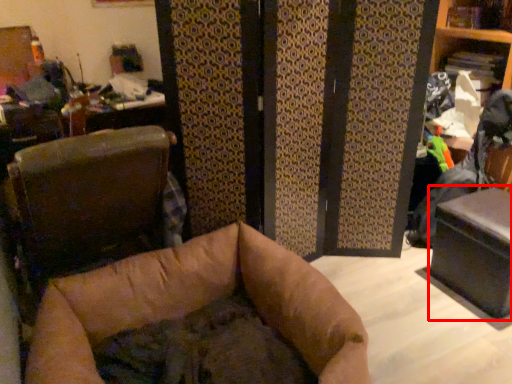
Question: From the image's perspective, what is the correct spatial relationship of table (annotated by the red box) in relation to furniture?

Choices:
 (A) above
 (B) below

Answer: (B)